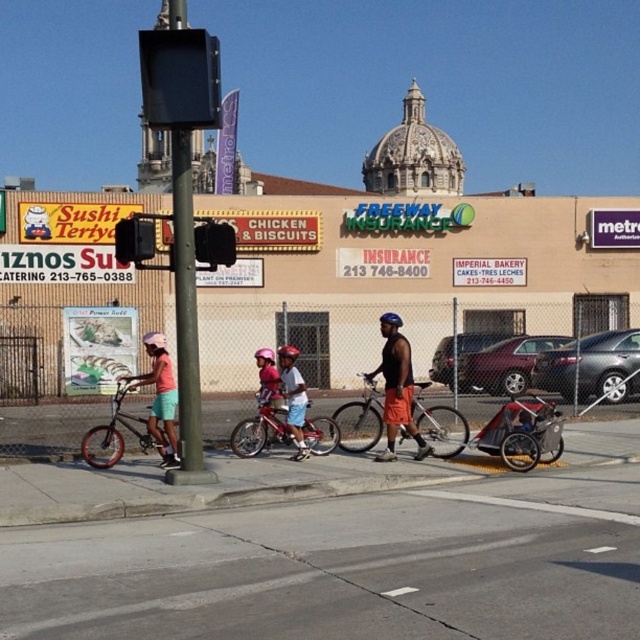
Can you confirm if shiny red bicycle at center is bigger than metallic black traffic light at upper center?

Correct, shiny red bicycle at center is larger in size than metallic black traffic light at upper center.

Describe the element at coordinates (259, 429) in the screenshot. I see `shiny red bicycle at center` at that location.

Is point (332, 436) farther from viewer compared to point (208, 253)?

Yes.

Locate an element on the screen. This screenshot has height=640, width=640. shiny red bicycle at center is located at coordinates (259, 429).

Is silver metallic bicycle at center to the right of matte black sedan at center from the viewer's perspective?

Incorrect, silver metallic bicycle at center is not on the right side of matte black sedan at center.

From the picture: Between silver metallic bicycle at center and matte black sedan at center, which one appears on the left side from the viewer's perspective?

silver metallic bicycle at center is more to the left.

Who is more distant from viewer, (422, 424) or (472, 371)?

The point (472, 371) is more distant.

At what (x,y) coordinates should I click in order to perform the action: click on silver metallic bicycle at center. Please return your answer as a coordinate pair (x, y). The height and width of the screenshot is (640, 640). Looking at the image, I should click on (360, 419).

Which is more to the right, matte black bicycle at center or light blue denim shorts at center?

Positioned to the right is matte black bicycle at center.

Does point (394, 330) come behind point (296, 396)?

No, it is in front of (296, 396).

Identify the location of matte black bicycle at center. The height and width of the screenshot is (640, 640). (396, 387).